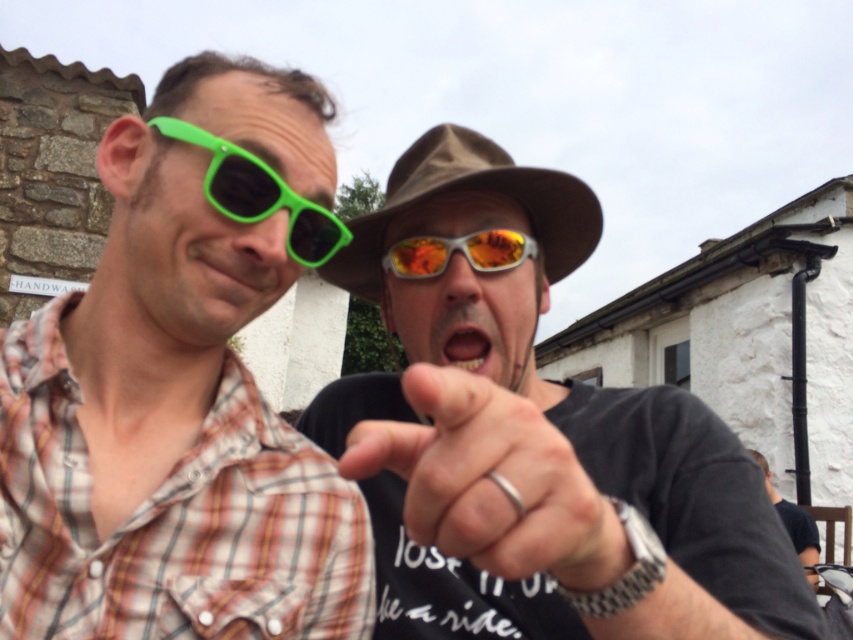
You are standing in front of the two people in the image. You want to hand a pair of sunglasses to the person on the left. Which pair of sunglasses is closer to you, the green plastic sunglasses at left or the matte green sunglasses at upper left?

The green plastic sunglasses at left is closer to the viewer than the matte green sunglasses at upper left, so the green plastic sunglasses at left is closer to you.

You are a photographer trying to capture a candid shot of the two people in the scene. You notice the matte green plastic sunglasses at left and the brown fabric fedora at center. Which object is positioned lower in the frame?

The matte green plastic sunglasses at left is below the brown fabric fedora at center, so it is positioned lower in the frame.

You are a photographer trying to capture a closeup of the yellow glossy teeth at center. However, the shiny orange reflective goggles at center are blocking your view. Can you adjust your position to see the teeth without moving the objects? Explain why or why not.

The shiny orange reflective goggles at center are closer to you than the yellow glossy teeth at center. By moving your camera position slightly to the side or angle, you can shift the perspective so that the goggles no longer block the view of the teeth since they are in front.